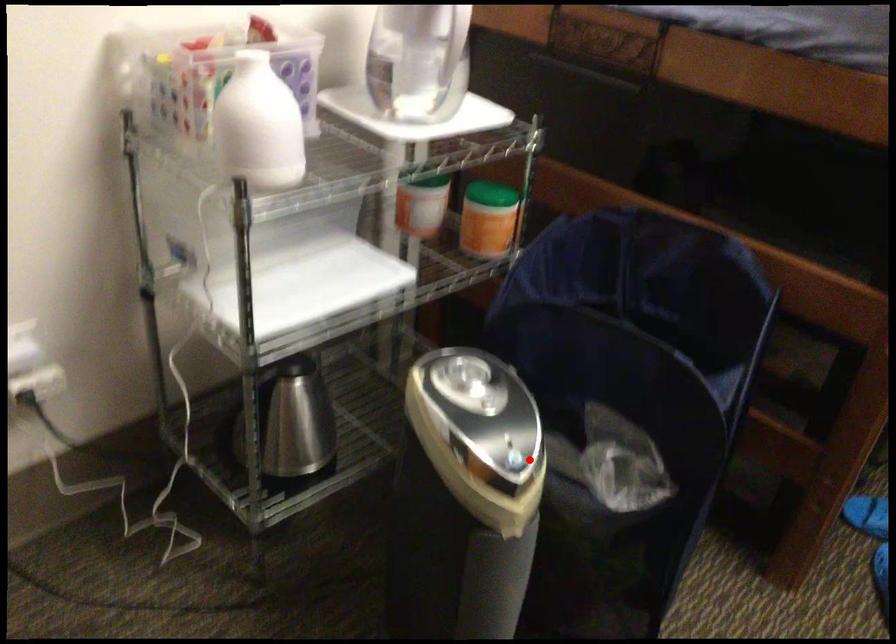
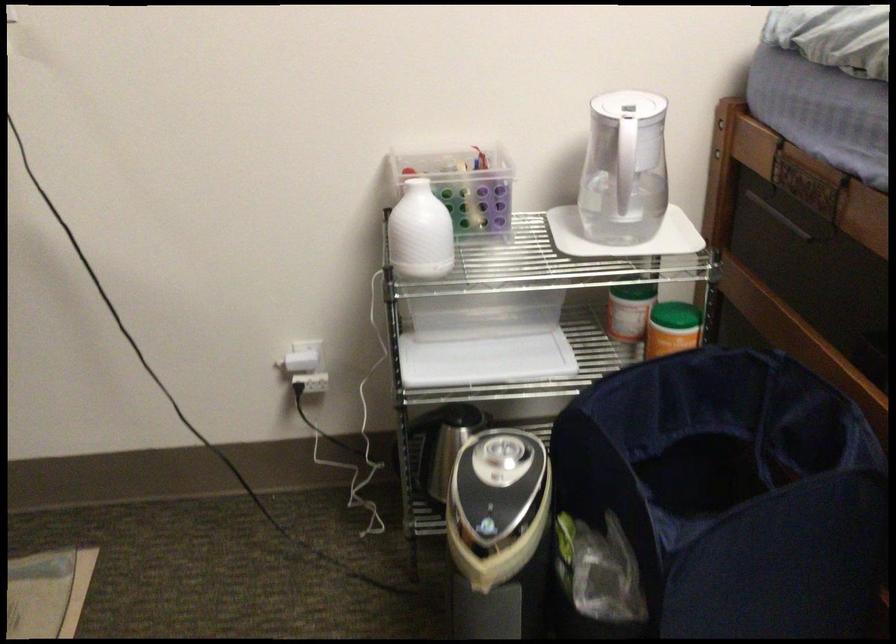
Question: A red point is marked in image1. In image2, is the corresponding 3D point closer to the camera or farther? Reply with the corresponding letter.

Choices:
 (A) The corresponding 3D point is closer.
 (B) The corresponding 3D point is farther.

Answer: (B)